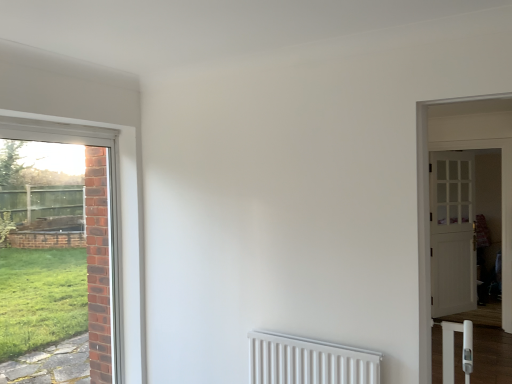
Question: Based on their positions, is matte glass door at left, the 1th door viewed from the front, located to the left or right of white wooden door at right, the first door from the right?

Choices:
 (A) left
 (B) right

Answer: (A)

Question: From their relative heights in the image, would you say matte glass door at left, which is counted as the 3th door, starting from the back, is taller or shorter than white wooden door at right, the first door from the right?

Choices:
 (A) short
 (B) tall

Answer: (A)

Question: Which is farther from the white wooden door at right, the 1th door when ordered from back to front?

Choices:
 (A) white wooden door at right, placed as the second door when sorted from front to back
 (B) matte glass door at left, which appears as the 3th door when viewed from the right
 (C) white plastic radiator at lower center

Answer: (B)

Question: Which of these objects is positioned farthest from the white plastic radiator at lower center?

Choices:
 (A) white wooden door at right, the 1th door when ordered from back to front
 (B) white wooden door at right, placed as the second door when sorted from front to back
 (C) matte glass door at left, placed as the 1th door when sorted from left to right

Answer: (A)